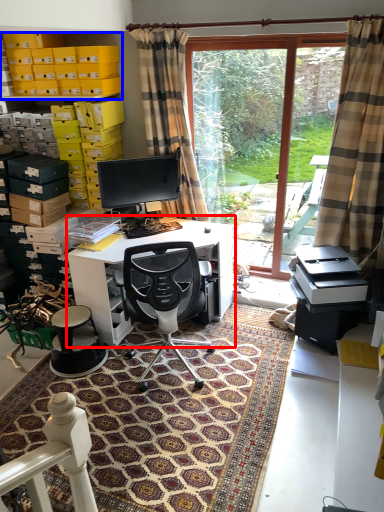
Question: Which of the following is the closest to the observer, desk (highlighted by a red box) or shelf (highlighted by a blue box)?

Choices:
 (A) desk
 (B) shelf

Answer: (A)